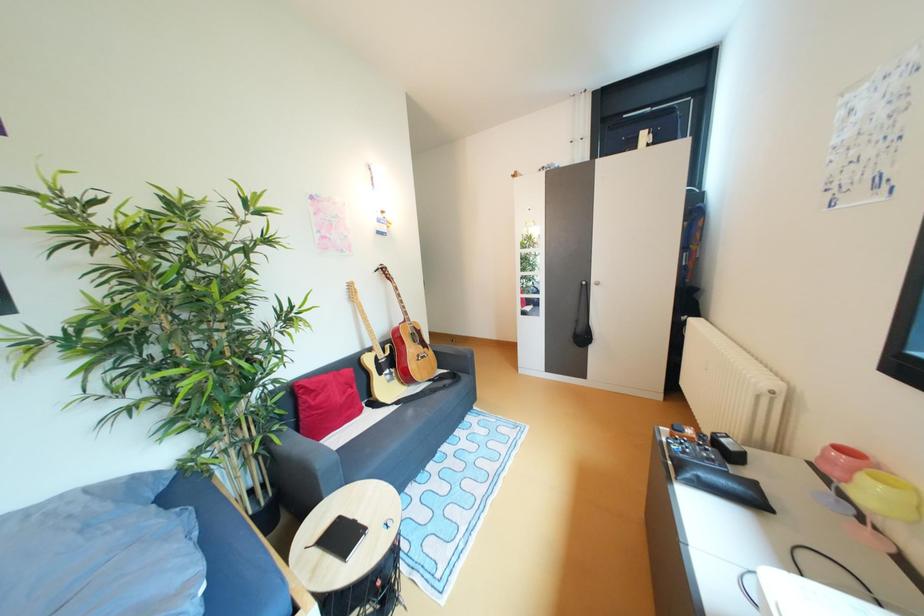
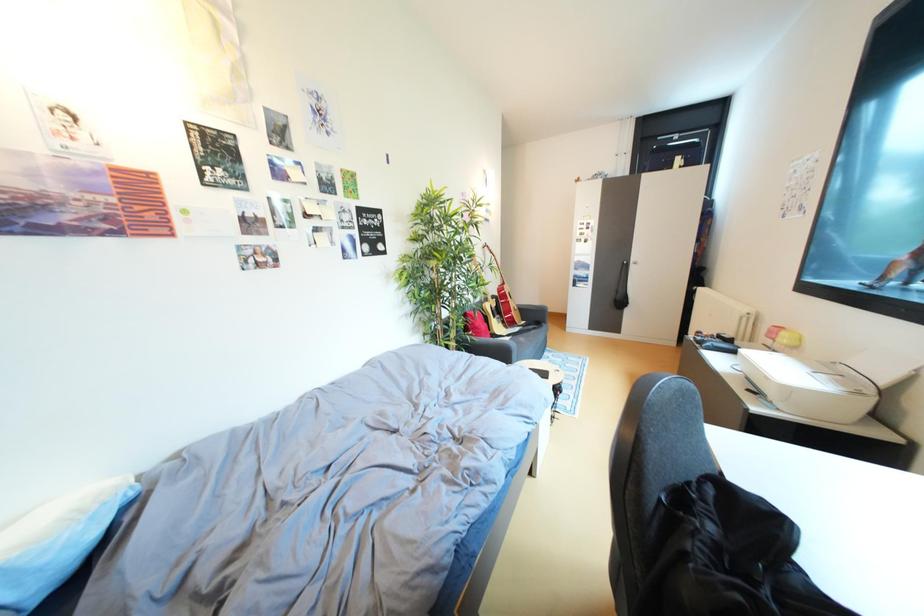
Which direction would the cameraman need to move to produce the second image?

The cameraman moved toward left, backward.